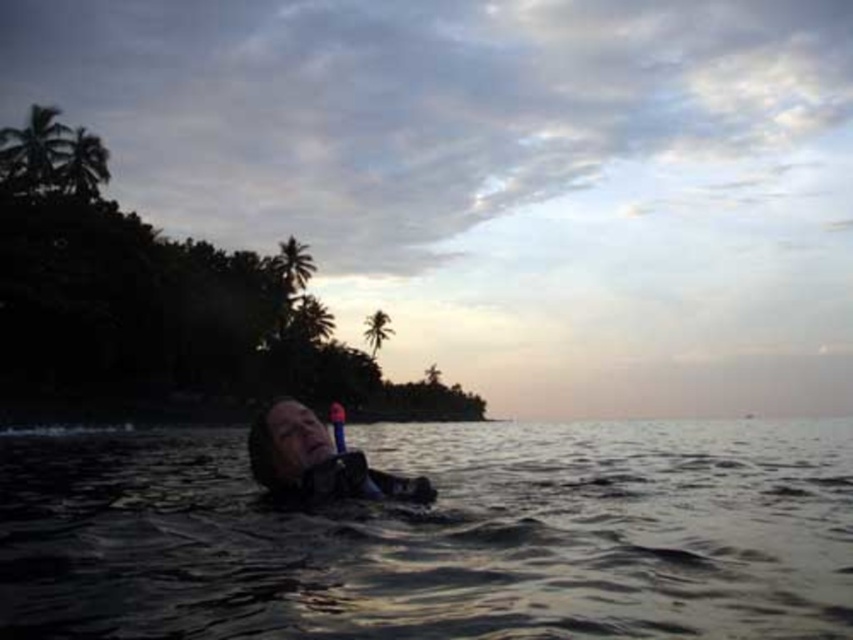
You are a lifeguard observing the scene from the shore. You notice the dark matte water at center and the matte black wetsuit at center. Which object is closer to you?

The dark matte water at center is closer to you because it is in front of the matte black wetsuit at center.

You are standing on a beach and see the dark matte water at center and the matte black wetsuit at center. Which object is positioned to the right of the other?

The dark matte water at center is to the right of the matte black wetsuit at center.

You are a lifeguard on duty and notice a swimmer in the water. You see the dark matte water at center and the matte black wetsuit at center. Which object is positioned lower in the scene?

The dark matte water at center is positioned lower than the matte black wetsuit at center.